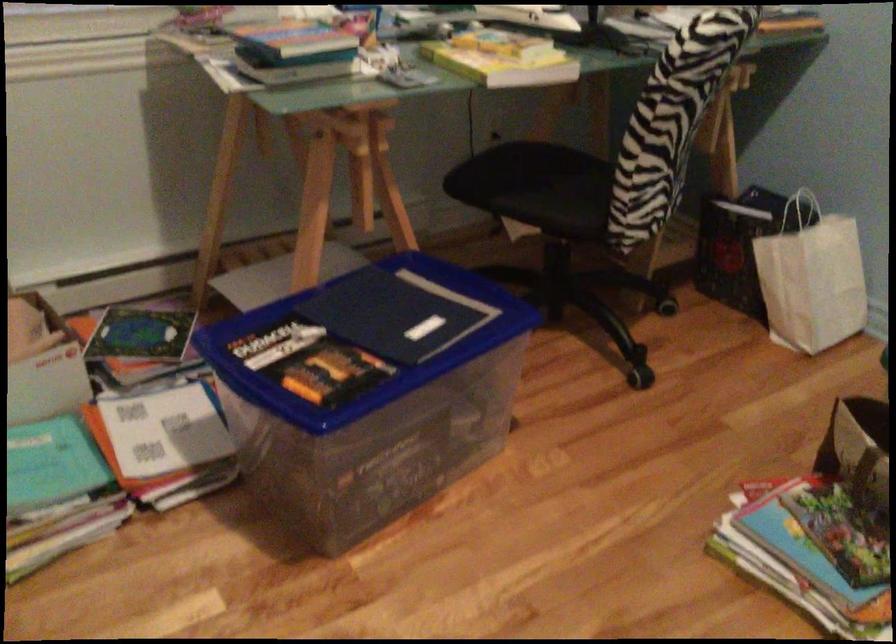
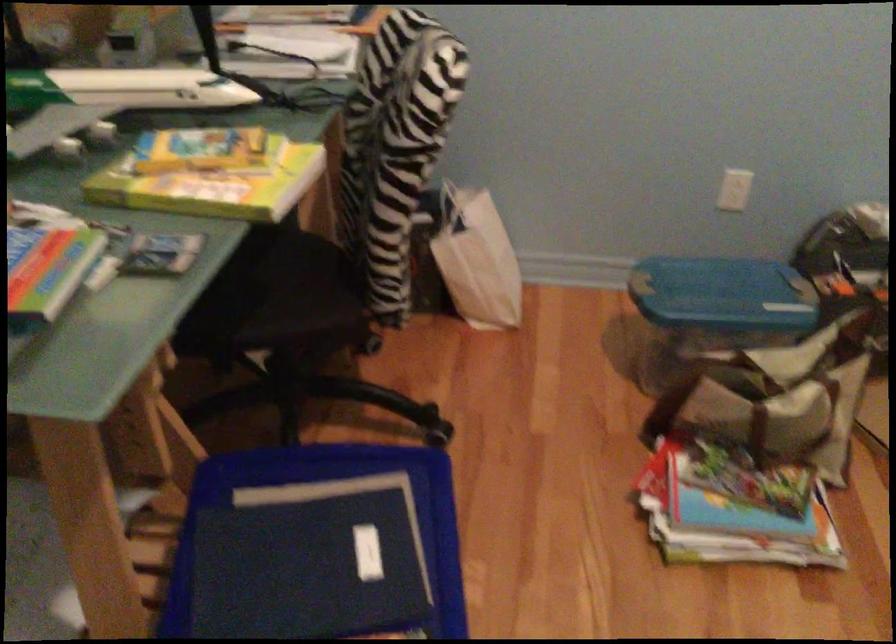
Question: The camera is either moving clockwise (left) or counter-clockwise (right) around the object. The first image is from the beginning of the video and the second image is from the end. Is the camera moving left or right when shooting the video?

Choices:
 (A) Left
 (B) Right

Answer: (A)